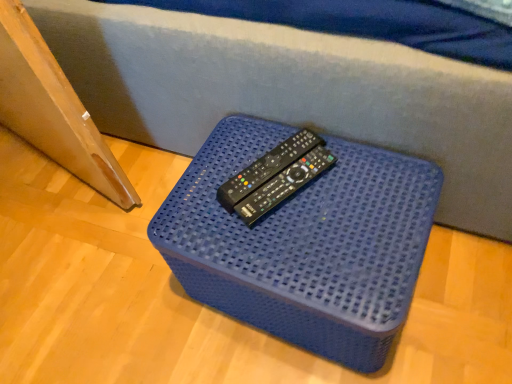
Question: Does black plastic remote at center come in front of blue plastic container at center?

Choices:
 (A) no
 (B) yes

Answer: (A)

Question: From the image's perspective, is black plastic remote at center above blue plastic container at center?

Choices:
 (A) no
 (B) yes

Answer: (B)

Question: Is black plastic remote at center facing towards blue plastic container at center?

Choices:
 (A) yes
 (B) no

Answer: (B)

Question: Is black plastic remote at center oriented away from blue plastic container at center?

Choices:
 (A) no
 (B) yes

Answer: (A)

Question: From the image's perspective, would you say black plastic remote at center is shown under blue plastic container at center?

Choices:
 (A) yes
 (B) no

Answer: (B)

Question: Considering the relative sizes of black plastic remote at center and blue plastic container at center in the image provided, is black plastic remote at center thinner than blue plastic container at center?

Choices:
 (A) yes
 (B) no

Answer: (A)

Question: Can you confirm if blue plastic container at center is positioned to the right of black plastic remote at center?

Choices:
 (A) no
 (B) yes

Answer: (B)

Question: Is blue plastic container at center placed right next to black plastic remote at center?

Choices:
 (A) no
 (B) yes

Answer: (A)

Question: Is black plastic remote at center completely or partially inside blue plastic container at center?

Choices:
 (A) no
 (B) yes

Answer: (A)

Question: Is blue plastic container at center wider than black plastic remote at center?

Choices:
 (A) no
 (B) yes

Answer: (B)

Question: Is blue plastic container at center taller than black plastic remote at center?

Choices:
 (A) yes
 (B) no

Answer: (A)

Question: Does blue plastic container at center have a lesser height compared to black plastic remote at center?

Choices:
 (A) yes
 (B) no

Answer: (B)

Question: From the image's perspective, relative to black plastic remote at center, is blue plastic container at center above or below?

Choices:
 (A) above
 (B) below

Answer: (B)